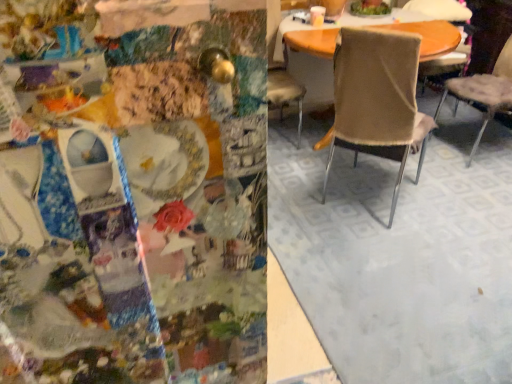
Measure the distance between point (x=287, y=99) and camera.

A distance of 9.90 feet exists between point (x=287, y=99) and camera.

This screenshot has height=384, width=512. Describe the element at coordinates (285, 93) in the screenshot. I see `beige fabric chair at center, marked as the fourth chair in a right-to-left arrangement` at that location.

What do you see at coordinates (485, 93) in the screenshot?
I see `beige fabric chair at center, the fourth chair when ordered from left to right` at bounding box center [485, 93].

The image size is (512, 384). Find the location of `beige fabric chair at center, positioned as the 3th chair in left-to-right order`. beige fabric chair at center, positioned as the 3th chair in left-to-right order is located at coordinates (443, 11).

Find the location of a particular element. This screenshot has width=512, height=384. beige fabric chair at center, which is the 1th chair in left-to-right order is located at coordinates (285, 93).

Is beige fabric chair at center, positioned as the 3th chair in left-to-right order, inside the boundaries of beige fabric chair at center, which is counted as the 1th chair, starting from the right, or outside?

beige fabric chair at center, positioned as the 3th chair in left-to-right order, is spatially situated outside beige fabric chair at center, which is counted as the 1th chair, starting from the right.

Is beige fabric chair at center, positioned as the 3th chair in left-to-right order, turned away from beige fabric chair at center, which is counted as the 1th chair, starting from the right?

No, beige fabric chair at center, positioned as the 3th chair in left-to-right order,'s orientation is not away from beige fabric chair at center, which is counted as the 1th chair, starting from the right.

Considering the sizes of objects beige fabric chair at center, positioned as the second chair in right-to-left order, and beige fabric chair at center, which is counted as the 1th chair, starting from the right, in the image provided, who is smaller, beige fabric chair at center, positioned as the second chair in right-to-left order, or beige fabric chair at center, which is counted as the 1th chair, starting from the right,?

With smaller size is beige fabric chair at center, positioned as the second chair in right-to-left order.

Is point (279, 111) more distant than point (373, 55)?

That is True.

Choose the correct answer: Is beige fabric chair at center, which is the 1th chair in left-to-right order, inside beige fabric chair at center, arranged as the third chair when viewed from the right, or outside it?

beige fabric chair at center, which is the 1th chair in left-to-right order, cannot be found inside beige fabric chair at center, arranged as the third chair when viewed from the right.

From a real-world perspective, which object rests below the other?

Answer: beige fabric chair at center, arranged as the third chair when viewed from the right, is physically lower.

Which is in front, beige fabric chair at center, marked as the fourth chair in a right-to-left arrangement, or beige fabric chair at center, arranged as the third chair when viewed from the right?

beige fabric chair at center, arranged as the third chair when viewed from the right.

Is the position of beige fabric chair at center, positioned as the second chair in right-to-left order, more distant than that of beige fabric chair at center, which is the 1th chair in left-to-right order?

Yes, it is.

From the image's perspective, is beige fabric chair at center, positioned as the 3th chair in left-to-right order, on top of beige fabric chair at center, which is the 1th chair in left-to-right order?

Yes, from the image's perspective, beige fabric chair at center, positioned as the 3th chair in left-to-right order, is above beige fabric chair at center, which is the 1th chair in left-to-right order.

Does beige fabric chair at center, positioned as the 3th chair in left-to-right order, turn towards beige fabric chair at center, marked as the fourth chair in a right-to-left arrangement?

No, beige fabric chair at center, positioned as the 3th chair in left-to-right order, is not turned towards beige fabric chair at center, marked as the fourth chair in a right-to-left arrangement.

From the image's perspective, count 1st chairs upward from the beige fabric chair at center, the fourth chair when ordered from left to right, and point to it. Please provide its 2D coordinates.

[(285, 93)]

Is beige fabric chair at center, the fourth chair when ordered from left to right, positioned with its back to beige fabric chair at center, marked as the fourth chair in a right-to-left arrangement?

No, beige fabric chair at center, the fourth chair when ordered from left to right, is not facing away from beige fabric chair at center, marked as the fourth chair in a right-to-left arrangement.

Based on the photo, can you confirm if beige fabric chair at center, the fourth chair when ordered from left to right, is positioned to the left of beige fabric chair at center, which is the 1th chair in left-to-right order?

In fact, beige fabric chair at center, the fourth chair when ordered from left to right, is to the right of beige fabric chair at center, which is the 1th chair in left-to-right order.

Consider the image. How many degrees apart are the facing directions of beige fabric chair at center, placed as the second chair when sorted from left to right, and beige fabric chair at center, which is counted as the 1th chair, starting from the right?

The facing directions of beige fabric chair at center, placed as the second chair when sorted from left to right, and beige fabric chair at center, which is counted as the 1th chair, starting from the right, are 65.8 degrees apart.

Is beige fabric chair at center, arranged as the third chair when viewed from the right, wider than beige fabric chair at center, the fourth chair when ordered from left to right?

Yes, beige fabric chair at center, arranged as the third chair when viewed from the right, is wider than beige fabric chair at center, the fourth chair when ordered from left to right.

Considering the relative positions of beige fabric chair at center, arranged as the third chair when viewed from the right, and beige fabric chair at center, the fourth chair when ordered from left to right, in the image provided, is beige fabric chair at center, arranged as the third chair when viewed from the right, in front of beige fabric chair at center, the fourth chair when ordered from left to right,?

Yes, beige fabric chair at center, arranged as the third chair when viewed from the right, is in front of beige fabric chair at center, the fourth chair when ordered from left to right.

Do you think beige fabric chair at center, which is counted as the 1th chair, starting from the right, is within beige fabric chair at center, placed as the second chair when sorted from left to right, or outside of it?

beige fabric chair at center, which is counted as the 1th chair, starting from the right, is not enclosed by beige fabric chair at center, placed as the second chair when sorted from left to right.

Is beige fabric chair at center, which is counted as the 1th chair, starting from the right, oriented away from beige fabric chair at center, placed as the second chair when sorted from left to right?

No.

Based on the photo, would you consider beige fabric chair at center, the fourth chair when ordered from left to right, to be distant from beige fabric chair at center, arranged as the third chair when viewed from the right?

No, beige fabric chair at center, the fourth chair when ordered from left to right, is not far away from beige fabric chair at center, arranged as the third chair when viewed from the right.

Is beige fabric chair at center, which is counted as the 1th chair, starting from the right, smaller than beige fabric chair at center, placed as the second chair when sorted from left to right?

Actually, beige fabric chair at center, which is counted as the 1th chair, starting from the right, might be larger than beige fabric chair at center, placed as the second chair when sorted from left to right.

From a real-world perspective, is beige fabric chair at center, positioned as the second chair in right-to-left order, over beige fabric chair at center, placed as the second chair when sorted from left to right?

No, from a real-world perspective, beige fabric chair at center, positioned as the second chair in right-to-left order, is not above beige fabric chair at center, placed as the second chair when sorted from left to right.

How different are the orientations of beige fabric chair at center, positioned as the 3th chair in left-to-right order, and beige fabric chair at center, placed as the second chair when sorted from left to right, in degrees?

The facing directions of beige fabric chair at center, positioned as the 3th chair in left-to-right order, and beige fabric chair at center, placed as the second chair when sorted from left to right, are 171 degrees apart.

Is beige fabric chair at center, positioned as the 3th chair in left-to-right order, beside beige fabric chair at center, placed as the second chair when sorted from left to right?

There is a gap between beige fabric chair at center, positioned as the 3th chair in left-to-right order, and beige fabric chair at center, placed as the second chair when sorted from left to right.

There is a beige fabric chair at center, arranged as the third chair when viewed from the right. Where is `the 3rd chair above it (from the image's perspective)`? The height and width of the screenshot is (384, 512). the 3rd chair above it (from the image's perspective) is located at coordinates (443, 11).

Locate an element on the screen. chair that is under the beige fabric chair at center, the fourth chair when ordered from left to right (from a real-world perspective) is located at coordinates (443, 11).

This screenshot has width=512, height=384. Identify the location of chair that is on the left side of beige fabric chair at center, placed as the second chair when sorted from left to right. (285, 93).

Based on their spatial positions, is beige fabric chair at center, which is the 1th chair in left-to-right order, or beige fabric chair at center, arranged as the third chair when viewed from the right, closer to beige fabric chair at center, the fourth chair when ordered from left to right?

Based on the image, beige fabric chair at center, arranged as the third chair when viewed from the right, appears to be nearer to beige fabric chair at center, the fourth chair when ordered from left to right.

Estimate the real-world distances between objects in this image. Which object is further from beige fabric chair at center, which is the 1th chair in left-to-right order, beige fabric chair at center, positioned as the 3th chair in left-to-right order, or beige fabric chair at center, arranged as the third chair when viewed from the right?

Among the two, beige fabric chair at center, positioned as the 3th chair in left-to-right order, is located further to beige fabric chair at center, which is the 1th chair in left-to-right order.

Consider the image. Estimate the real-world distances between objects in this image. Which object is closer to beige fabric chair at center, placed as the second chair when sorted from left to right, beige fabric chair at center, marked as the fourth chair in a right-to-left arrangement, or beige fabric chair at center, positioned as the second chair in right-to-left order?

beige fabric chair at center, marked as the fourth chair in a right-to-left arrangement, lies closer to beige fabric chair at center, placed as the second chair when sorted from left to right, than the other object.

Looking at the image, which one is located closer to beige fabric chair at center, positioned as the 3th chair in left-to-right order, beige fabric chair at center, arranged as the third chair when viewed from the right, or beige fabric chair at center, which is counted as the 1th chair, starting from the right?

beige fabric chair at center, which is counted as the 1th chair, starting from the right, lies closer to beige fabric chair at center, positioned as the 3th chair in left-to-right order, than the other object.

Estimate the real-world distances between objects in this image. Which object is closer to beige fabric chair at center, the fourth chair when ordered from left to right, beige fabric chair at center, arranged as the third chair when viewed from the right, or beige fabric chair at center, marked as the fourth chair in a right-to-left arrangement?

beige fabric chair at center, arranged as the third chair when viewed from the right, lies closer to beige fabric chair at center, the fourth chair when ordered from left to right, than the other object.

Based on their spatial positions, is beige fabric chair at center, arranged as the third chair when viewed from the right, or beige fabric chair at center, the fourth chair when ordered from left to right, further from beige fabric chair at center, marked as the fourth chair in a right-to-left arrangement?

beige fabric chair at center, the fourth chair when ordered from left to right, lies further to beige fabric chair at center, marked as the fourth chair in a right-to-left arrangement, than the other object.

Based on their spatial positions, is beige fabric chair at center, marked as the fourth chair in a right-to-left arrangement, or beige fabric chair at center, arranged as the third chair when viewed from the right, closer to beige fabric chair at center, positioned as the second chair in right-to-left order?

Based on the image, beige fabric chair at center, marked as the fourth chair in a right-to-left arrangement, appears to be nearer to beige fabric chair at center, positioned as the second chair in right-to-left order.

Looking at the image, which one is located further to beige fabric chair at center, arranged as the third chair when viewed from the right, beige fabric chair at center, positioned as the second chair in right-to-left order, or beige fabric chair at center, the fourth chair when ordered from left to right?

Based on the image, beige fabric chair at center, positioned as the second chair in right-to-left order, appears to be further to beige fabric chair at center, arranged as the third chair when viewed from the right.

Locate an element on the screen. chair between beige fabric chair at center, which is the 1th chair in left-to-right order, and beige fabric chair at center, positioned as the 3th chair in left-to-right order is located at coordinates pos(378,101).